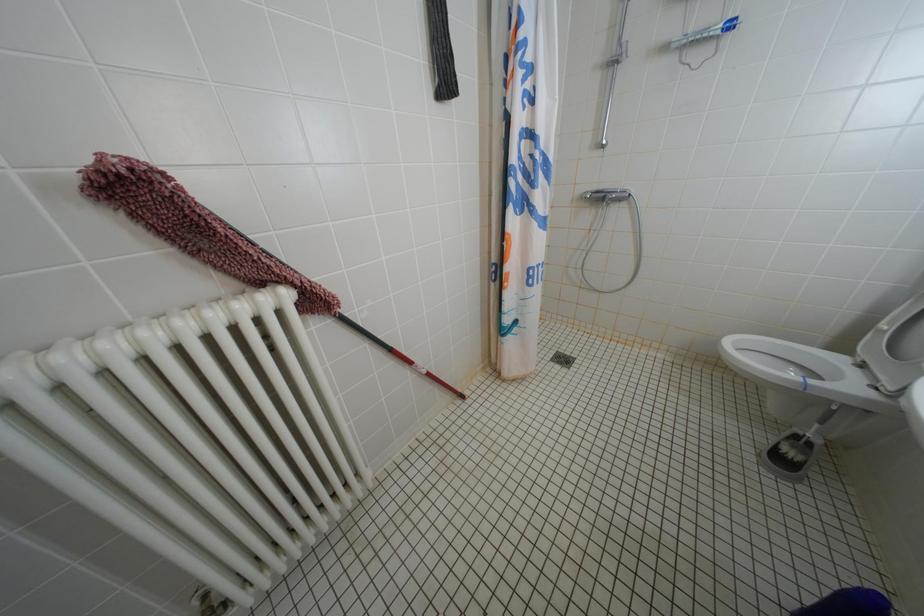
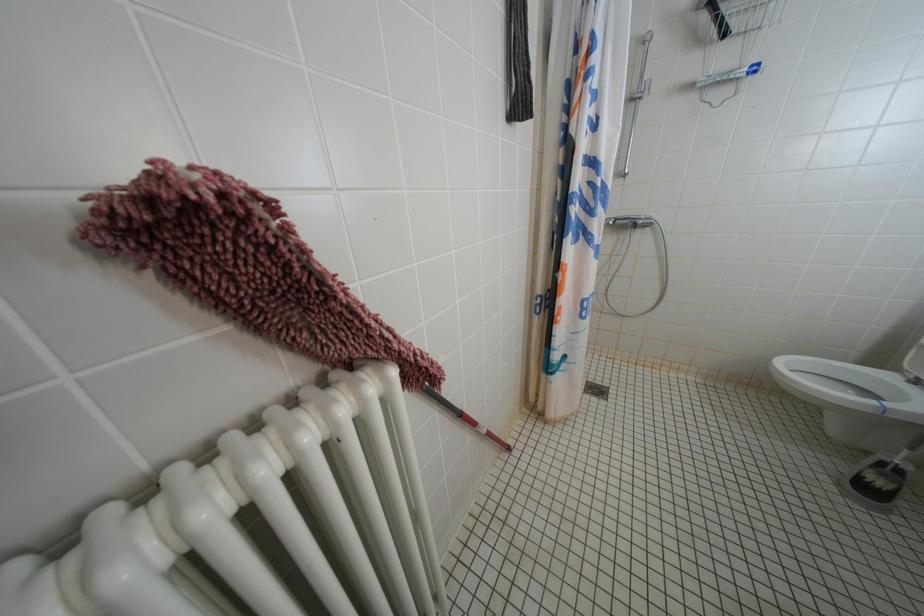
Question: Based on the continuous images, in which direction is the camera rotating? Reply with the corresponding letter.

Choices:
 (A) Left
 (B) Right
 (C) Up
 (D) Down

Answer: (B)